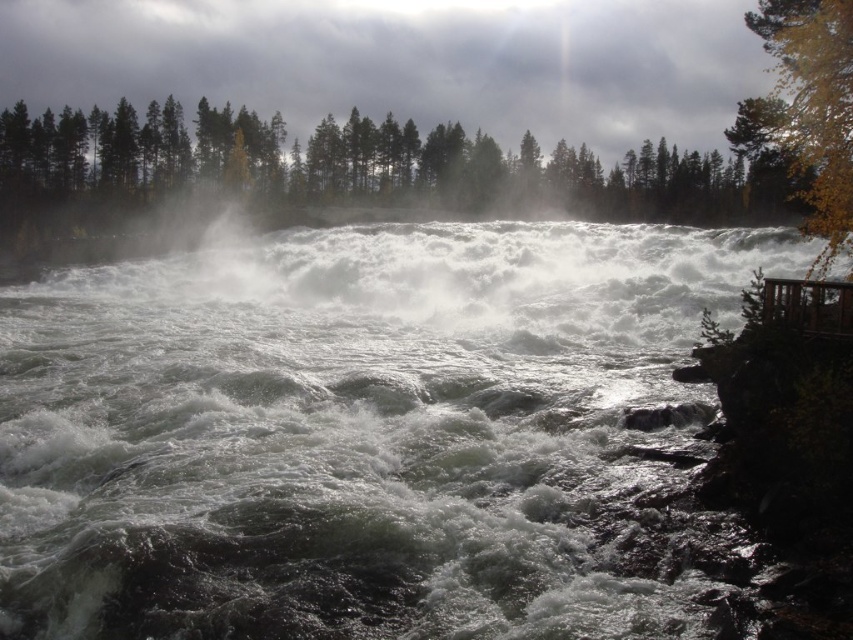
Which is below, white frothy water at center or yellow leafy tree at right?

white frothy water at center

Does white frothy water at center have a greater width compared to yellow leafy tree at right?

No.

Find the location of a particular element. The image size is (853, 640). white frothy water at center is located at coordinates (354, 432).